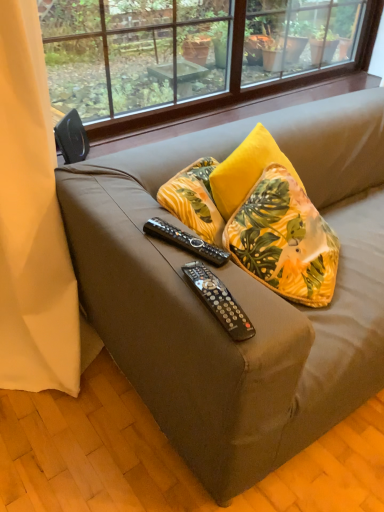
Question: From their relative heights in the image, would you say matte brown couch at center is taller or shorter than beige fabric curtain at left?

Choices:
 (A) tall
 (B) short

Answer: (B)

Question: From the image's perspective, is matte brown couch at center positioned above or below beige fabric curtain at left?

Choices:
 (A) above
 (B) below

Answer: (A)

Question: Which of these objects is positioned closest to the black plastic remote control at center, the 1th remote control in the back-to-front sequence?

Choices:
 (A) black plastic remote at center, which is counted as the first remote control, starting from the bottom
 (B) beige fabric curtain at left
 (C) yellow fabric pillow at upper right
 (D) matte brown couch at center
 (E) transparent glass window at upper center

Answer: (A)

Question: Considering the real-world distances, which object is farthest from the matte brown couch at center?

Choices:
 (A) beige fabric curtain at left
 (B) yellow fabric pillow at upper right
 (C) black plastic remote at center, arranged as the second remote control when viewed from the top
 (D) black plastic remote control at center, positioned as the 2th remote control in front-to-back order
 (E) transparent glass window at upper center

Answer: (E)